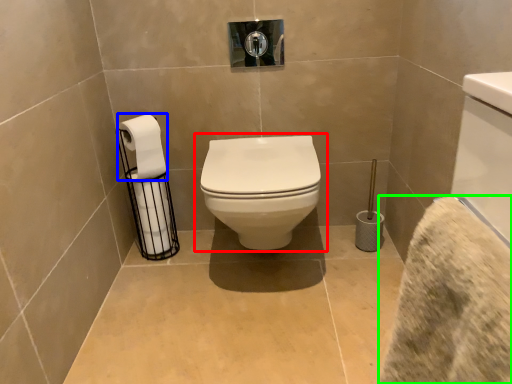
Question: Considering the real-world distances, which object is farthest from toilet (highlighted by a red box)? toilet paper (highlighted by a blue box) or bath towel (highlighted by a green box)?

Choices:
 (A) toilet paper
 (B) bath towel

Answer: (B)